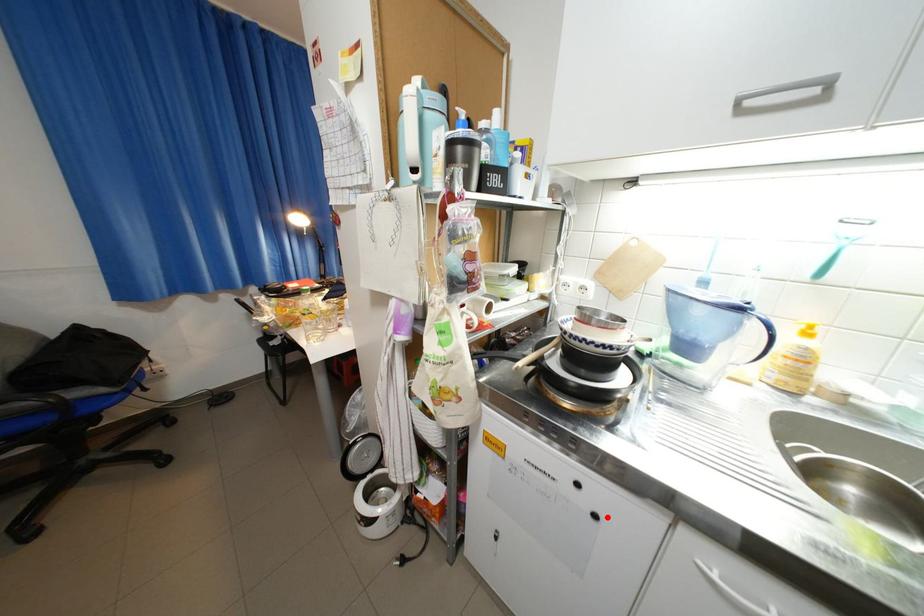
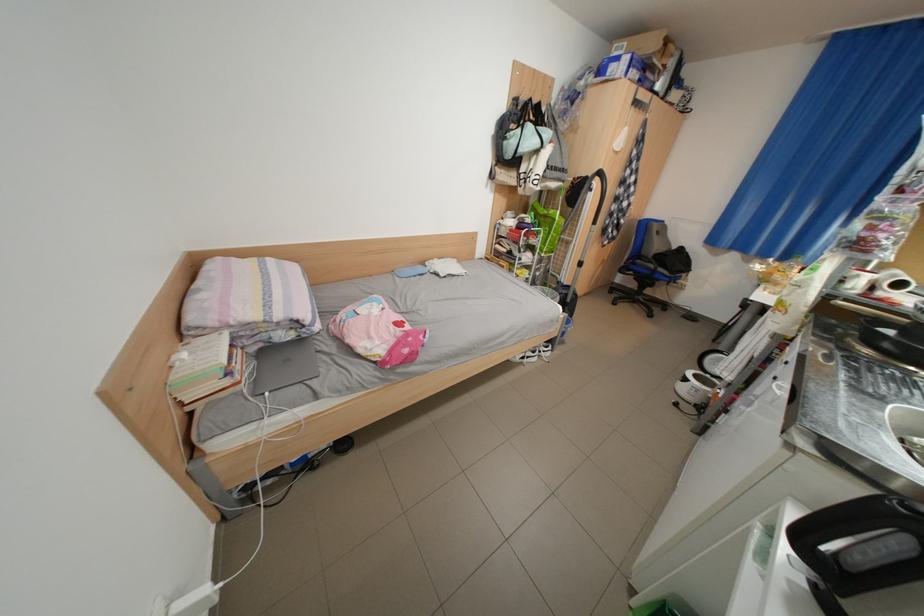
Question: I am providing you with two images of the same scene from different viewpoints. Given a red point in image1, look at the same physical point in image2. Is it:

Choices:
 (A) Closer to the viewpoint
 (B) Farther from the viewpoint

Answer: (B)